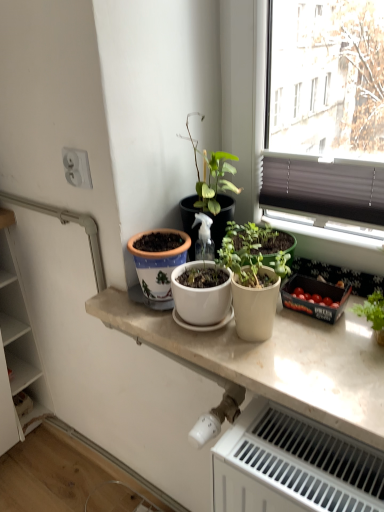
This screenshot has width=384, height=512. I want to click on blank space to the left of white ceramic pot at center, so click(x=115, y=304).